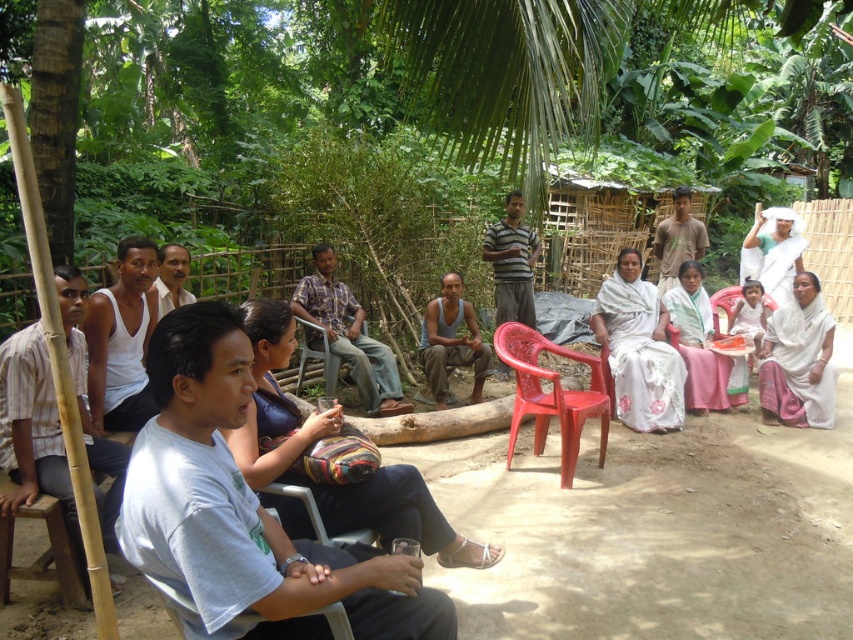
You are a photographer trying to capture the scene of the group of people in the rural setting. You want to focus on the white matte tank top at left. Where exactly should you point your camera to capture it?

You should point your camera to the coordinates point at point [120,339] to capture the white matte tank top at left.